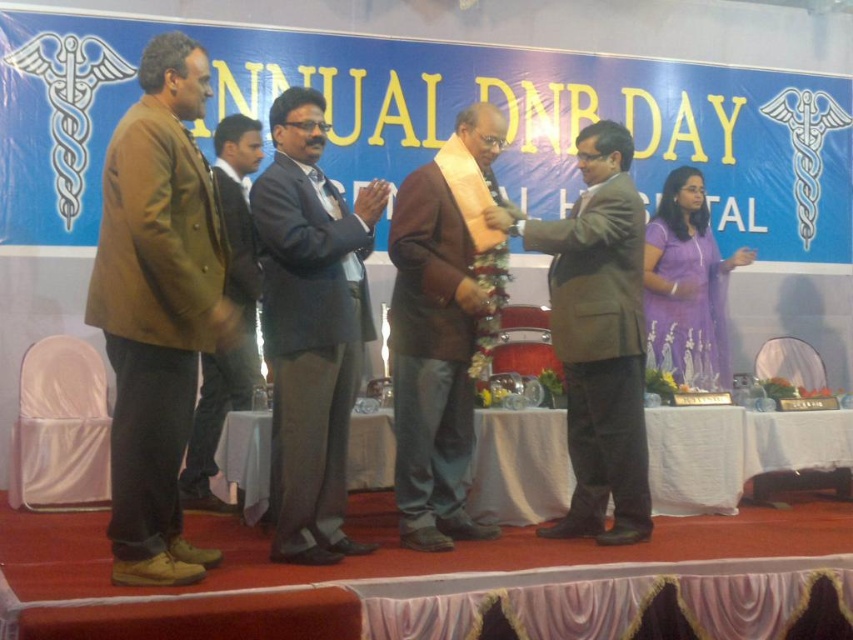
You are an attendee sitting in the front row of the stage. You see two individuals on the stage wearing a dark gray suit at center and a matte brown suit at center. Which one appears closer to you?

The dark gray suit at center appears closer to you because it is positioned closer to the viewer than the matte brown suit at center.

You are an event photographer at the Annual DNB Day ceremony. You need to capture a photo of both the brown leather jacket at left and the brown woolen jacket at left. Which jacket should you position to the right in your camera frame to include both in the shot?

The brown leather jacket at left is positioned to the right of the brown woolen jacket at left, so to include both in the shot, position the brown leather jacket at left to the right in your camera frame.